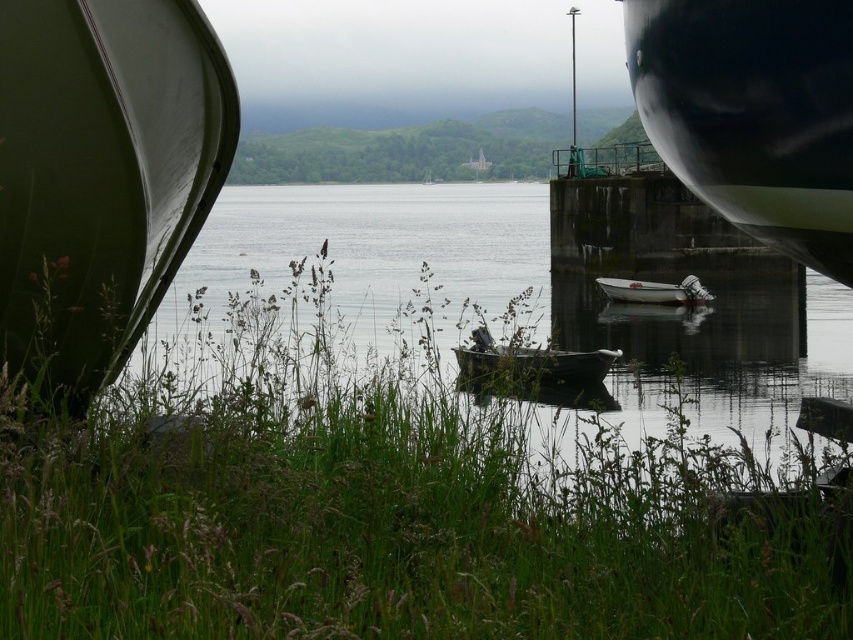
Question: Is green matte boat at left to the left of wooden boat at center from the viewer's perspective?

Choices:
 (A) no
 (B) yes

Answer: (B)

Question: Among these points, which one is farthest from the camera?

Choices:
 (A) click(x=795, y=93)
 (B) click(x=172, y=580)

Answer: (A)

Question: Does green grass at center lie in front of wooden boat at center?

Choices:
 (A) no
 (B) yes

Answer: (B)

Question: Which object is positioned farthest from the glossy black boat at right?

Choices:
 (A) green matte canoe at center
 (B) green matte boat at left
 (C) green grass at center
 (D) wooden boat at center

Answer: (D)

Question: Does green grass at center have a lesser width compared to green matte canoe at center?

Choices:
 (A) yes
 (B) no

Answer: (B)

Question: Which of the following is the farthest from the observer?

Choices:
 (A) (169, 358)
 (B) (457, 364)
 (C) (686, 42)

Answer: (B)